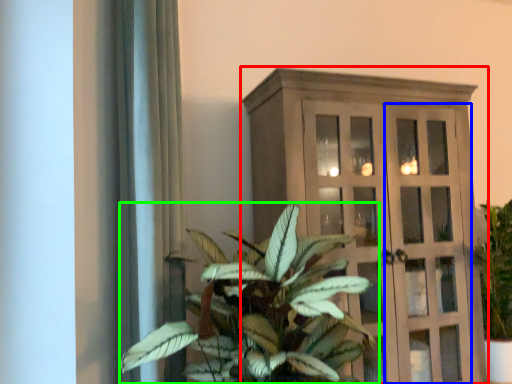
Question: Which is farther away from cupboard (highlighted by a red box)? screen door (highlighted by a blue box) or houseplant (highlighted by a green box)?

Choices:
 (A) screen door
 (B) houseplant

Answer: (B)